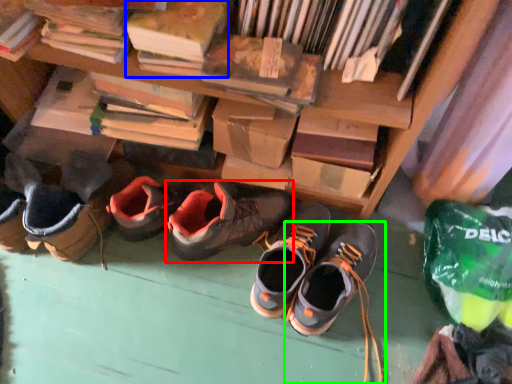
Question: Considering the real-world distances, which object is farthest from footwear (highlighted by a red box)? paperback book (highlighted by a blue box) or footwear (highlighted by a green box)?

Choices:
 (A) paperback book
 (B) footwear

Answer: (A)